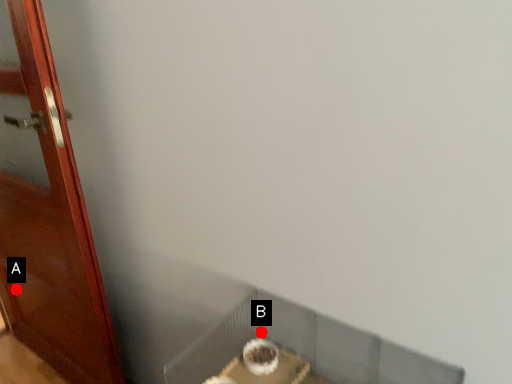
Question: Two points are circled on the image, labeled by A and B beside each circle. Which point is closer to the camera?

Choices:
 (A) A is closer
 (B) B is closer

Answer: (B)